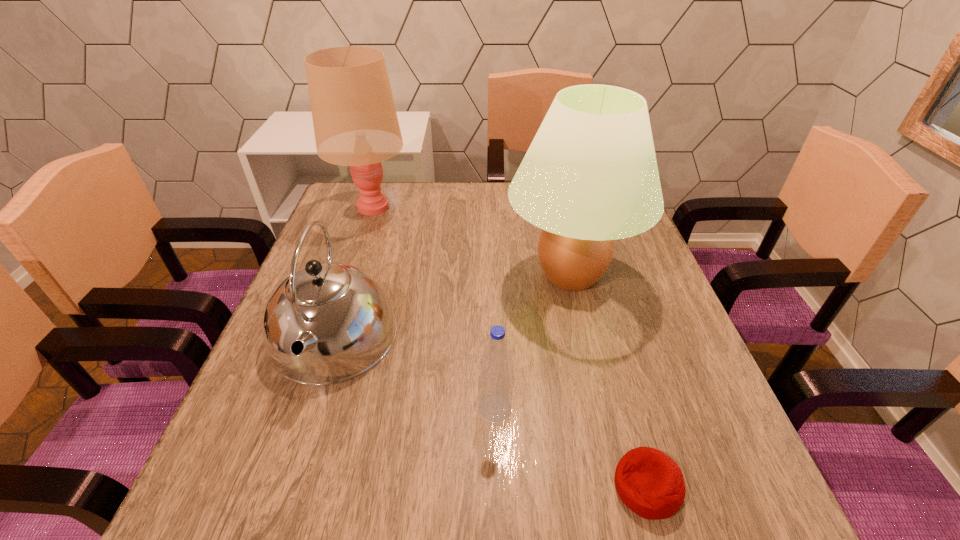
Identify the location of free space that is in between the second shortest object and the right lampshade. (533, 341).

Where is `vacant area that lies between the beanbag and the farthest object`? This screenshot has height=540, width=960. vacant area that lies between the beanbag and the farthest object is located at coordinates (510, 347).

Find the location of a particular element. This screenshot has height=540, width=960. unoccupied area between the right lampshade and the fourth tallest object is located at coordinates (533, 341).

This screenshot has height=540, width=960. What are the coordinates of `free point between the farthest object and the shortest object` in the screenshot? It's located at (x=510, y=347).

Locate an element on the screen. The height and width of the screenshot is (540, 960). free space between the right lampshade and the beanbag is located at coordinates (609, 381).

Where is `free space that is in between the farthest object and the shortest object`? free space that is in between the farthest object and the shortest object is located at coordinates (510, 347).

Identify the location of free space between the third object from left to right and the nearer lampshade. (533, 341).

Where is `free space between the right lampshade and the kettle`? free space between the right lampshade and the kettle is located at coordinates (451, 307).

The width and height of the screenshot is (960, 540). I want to click on free space between the farthest object and the right lampshade, so click(x=471, y=241).

At what (x,y) coordinates should I click in order to perform the action: click on empty space that is in between the water bottle and the left lampshade. Please return your answer as a coordinate pair (x, y). Looking at the image, I should click on (433, 307).